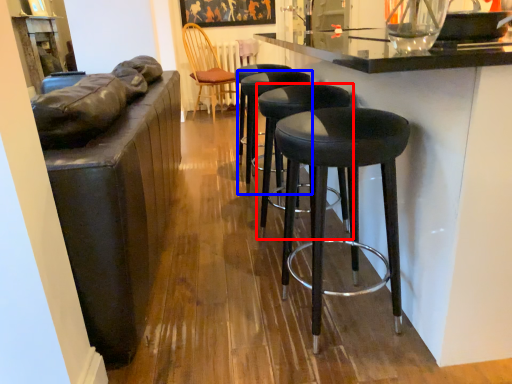
Question: Which object is further to the camera taking this photo, stool (highlighted by a red box) or stool (highlighted by a blue box)?

Choices:
 (A) stool
 (B) stool

Answer: (B)